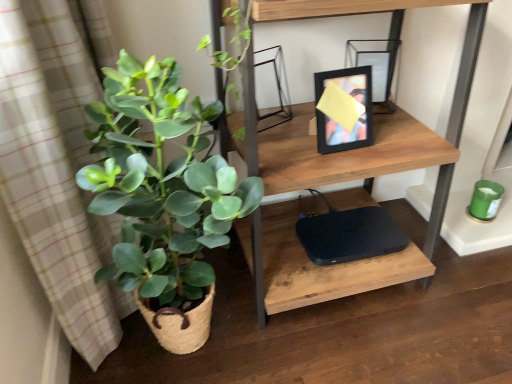
What do you see at coordinates (346, 167) in the screenshot? I see `wooden shelf at upper center` at bounding box center [346, 167].

Measure the distance between black matte computer at lower center and camera.

1.33 meters.

What do you see at coordinates (163, 198) in the screenshot?
I see `green woven basket at left` at bounding box center [163, 198].

I want to click on wooden shelf at upper center, so click(x=346, y=167).

From the picture: From the image's perspective, which one is positioned lower, wooden shelf at upper center or green woven basket at left?

green woven basket at left is shown below in the image.

Between wooden shelf at upper center and green woven basket at left, which one is positioned behind?

wooden shelf at upper center is more distant.

Is wooden shelf at upper center at the right side of green woven basket at left?

Indeed, wooden shelf at upper center is positioned on the right side of green woven basket at left.

Is wooden shelf at upper center not close to green woven basket at left?

No, wooden shelf at upper center is in close proximity to green woven basket at left.

Is wooden shelf at upper center in front of or behind black matte computer at lower center in the image?

wooden shelf at upper center is positioned closer to the viewer than black matte computer at lower center.

Is black matte computer at lower center at the back of wooden shelf at upper center?

No.

How different are the orientations of wooden shelf at upper center and black matte computer at lower center in degrees?

1.51 degrees.

Can you see wooden shelf at upper center touching black matte computer at lower center?

No, wooden shelf at upper center is not beside black matte computer at lower center.

Would you say black matte computer at lower center is a long distance from green woven basket at left?

black matte computer at lower center is near green woven basket at left, not far away.

From their relative heights in the image, would you say black matte computer at lower center is taller or shorter than green woven basket at left?

In the image, black matte computer at lower center appears to be shorter than green woven basket at left.

Choose the correct answer: Is black matte computer at lower center inside green woven basket at left or outside it?

black matte computer at lower center is outside green woven basket at left.

Between green woven basket at left and wooden shelf at upper center, which one has larger size?

wooden shelf at upper center.

Is green woven basket at left facing towards wooden shelf at upper center?

No, green woven basket at left is not oriented towards wooden shelf at upper center.

From a real-world perspective, between green woven basket at left and wooden shelf at upper center, who is vertically higher?

wooden shelf at upper center is physically above.

From the image's perspective, which one is positioned higher, green woven basket at left or wooden shelf at upper center?

wooden shelf at upper center.

Does green woven basket at left have a lesser width compared to black matte computer at lower center?

No.

Could black matte computer at lower center be considered to be inside green woven basket at left?

No, black matte computer at lower center is not inside green woven basket at left.

From a real-world perspective, which object stands above the other?

In real-world perspective, green woven basket at left is above.

Considering the sizes of objects black matte computer at lower center and wooden shelf at upper center in the image provided, who is thinner, black matte computer at lower center or wooden shelf at upper center?

black matte computer at lower center.

Between black matte computer at lower center and wooden shelf at upper center, which one is positioned behind?

black matte computer at lower center is behind.

Is point (347, 242) less distant than point (420, 258)?

No, it is not.

Is black matte computer at lower center turned away from wooden shelf at upper center?

Correct, black matte computer at lower center is looking away from wooden shelf at upper center.

You are a GUI agent. You are given a task and a screenshot of the screen. Output one action in this format:
    pyautogui.click(x=<x>, y=<y>)
    Task: Click on the houseplant to the left of wooden shelf at upper center
    
    Given the screenshot: What is the action you would take?
    pyautogui.click(x=163, y=198)

Locate an element on the screen. shelf above the black matte computer at lower center (from the image's perspective) is located at coordinates (346, 167).

Which object lies nearer to the anchor point green woven basket at left, black matte computer at lower center or wooden shelf at upper center?

Based on the image, wooden shelf at upper center appears to be nearer to green woven basket at left.

Which object lies further to the anchor point green woven basket at left, wooden shelf at upper center or black matte computer at lower center?

Based on the image, black matte computer at lower center appears to be further to green woven basket at left.

When comparing their distances from black matte computer at lower center, does wooden shelf at upper center or green woven basket at left seem closer?

Based on the image, wooden shelf at upper center appears to be nearer to black matte computer at lower center.

When comparing their distances from wooden shelf at upper center, does green woven basket at left or black matte computer at lower center seem further?

black matte computer at lower center.

Looking at the image, which one is located closer to black matte computer at lower center, green woven basket at left or wooden shelf at upper center?

wooden shelf at upper center is positioned closer to the anchor black matte computer at lower center.

Looking at the image, which one is located further to wooden shelf at upper center, black matte computer at lower center or green woven basket at left?

Among the two, black matte computer at lower center is located further to wooden shelf at upper center.

I want to click on shelf positioned between green woven basket at left and black matte computer at lower center from near to far, so click(346, 167).